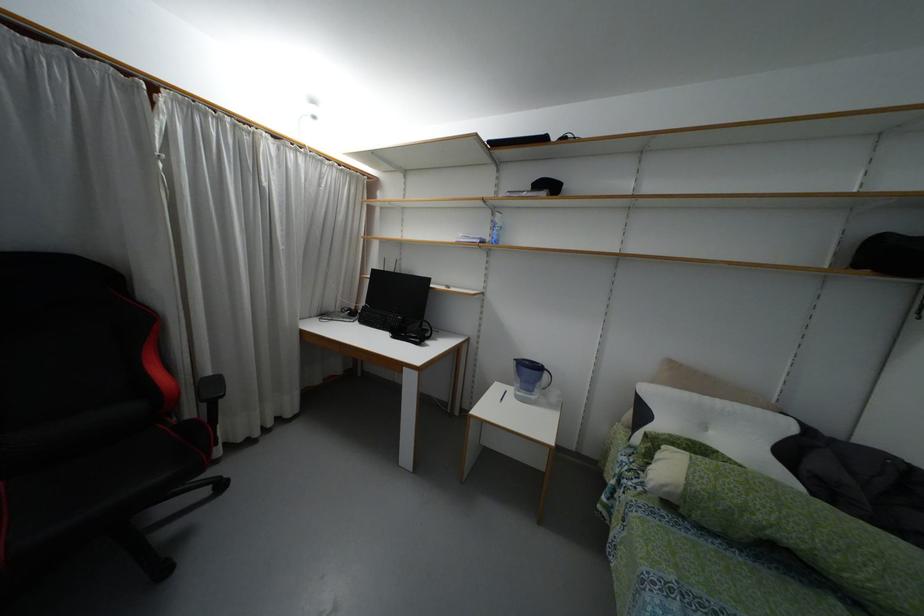
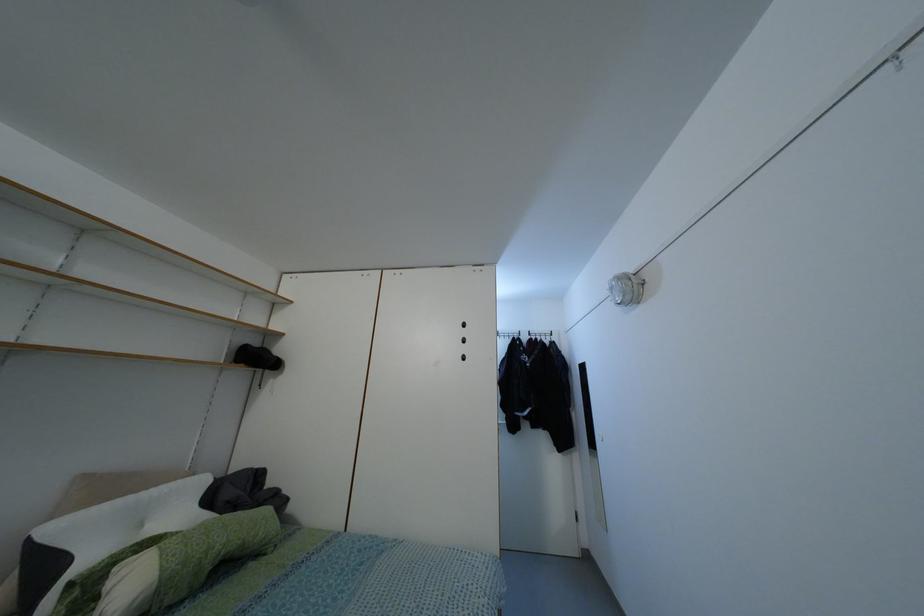
Question: The images are taken continuously from a first-person perspective. In which direction is your viewpoint rotating?

Choices:
 (A) Left
 (B) Right
 (C) Up
 (D) Down

Answer: (B)